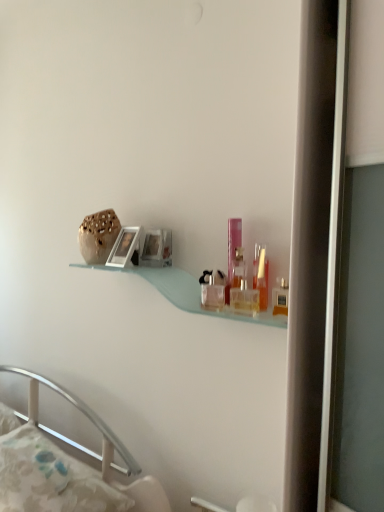
Question: From their relative heights in the image, would you say clear glass perfume bottles at center, which appears as the second toiletry when viewed from the back, is taller or shorter than pink plastic perfume at center, which is counted as the fourth toiletry, starting from the front?

Choices:
 (A) tall
 (B) short

Answer: (B)

Question: Relative to pink plastic perfume at center, which is counted as the fourth toiletry, starting from the front, is clear glass perfume bottles at center, which is the first toiletry in left-to-right order, in front or behind?

Choices:
 (A) front
 (B) behind

Answer: (A)

Question: Estimate the real-world distances between objects in this image. Which object is closer to the pink plastic perfume at center, the 1th toiletry when ordered from back to front?

Choices:
 (A) clear glass perfume bottles at center, which appears as the second toiletry when viewed from the back
 (B) translucent glass perfume bottle at upper right, which is the second toiletry from right to left
 (C) white fabric pillow at lower left
 (D) matte plastic toiletry at right, placed as the 4th toiletry when sorted from left to right
 (E) white glossy picture frame at upper center

Answer: (A)

Question: Estimate the real-world distances between objects in this image. Which object is closer to the white fabric pillow at lower left?

Choices:
 (A) matte plastic toiletry at right, the 1th toiletry when ordered from front to back
 (B) pink plastic perfume at center, which is counted as the second toiletry, starting from the left
 (C) clear glass perfume bottles at center, which is the first toiletry in left-to-right order
 (D) translucent glass perfume bottle at upper right, marked as the second toiletry in a front-to-back arrangement
 (E) white glossy picture frame at upper center

Answer: (E)